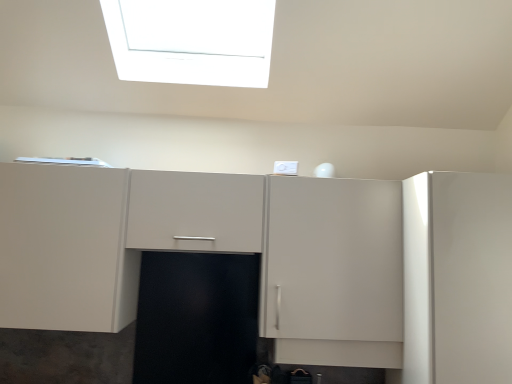
Question: Considering their positions, is glossy white cabinet at right, the second cabinetry from the left, located in front of or behind matte white cabinet at center, which appears as the 2th cabinetry when viewed from the right?

Choices:
 (A) behind
 (B) front

Answer: (B)

Question: From the image's perspective, is glossy white cabinet at right, the second cabinetry from the left, located above or below matte white cabinet at center, which appears as the 2th cabinetry when viewed from the right?

Choices:
 (A) above
 (B) below

Answer: (B)

Question: Looking at the image, does glossy white cabinet at right, the second cabinetry from the left, seem bigger or smaller compared to matte white cabinet at center, the first cabinetry from the left?

Choices:
 (A) big
 (B) small

Answer: (B)

Question: Looking at the image, does matte white cabinet at center, the first cabinetry from the left, seem bigger or smaller compared to glossy white cabinet at right, the second cabinetry from the left?

Choices:
 (A) small
 (B) big

Answer: (B)

Question: Considering the positions of matte white cabinet at center, the first cabinetry from the left, and glossy white cabinet at right, the 1th cabinetry positioned from the right, in the image, is matte white cabinet at center, the first cabinetry from the left, wider or thinner than glossy white cabinet at right, the 1th cabinetry positioned from the right,?

Choices:
 (A) wide
 (B) thin

Answer: (B)

Question: Does point (451, 211) appear closer or farther from the camera than point (462, 350)?

Choices:
 (A) farther
 (B) closer

Answer: (A)

Question: From the image's perspective, is matte white cabinet at center, which appears as the 2th cabinetry when viewed from the right, located above or below glossy white cabinet at right, the second cabinetry from the left?

Choices:
 (A) below
 (B) above

Answer: (B)